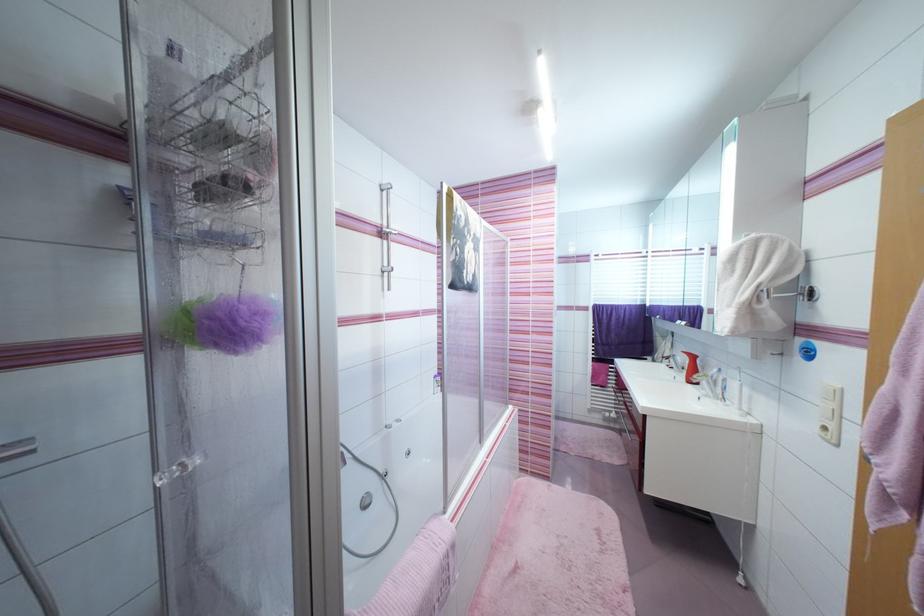
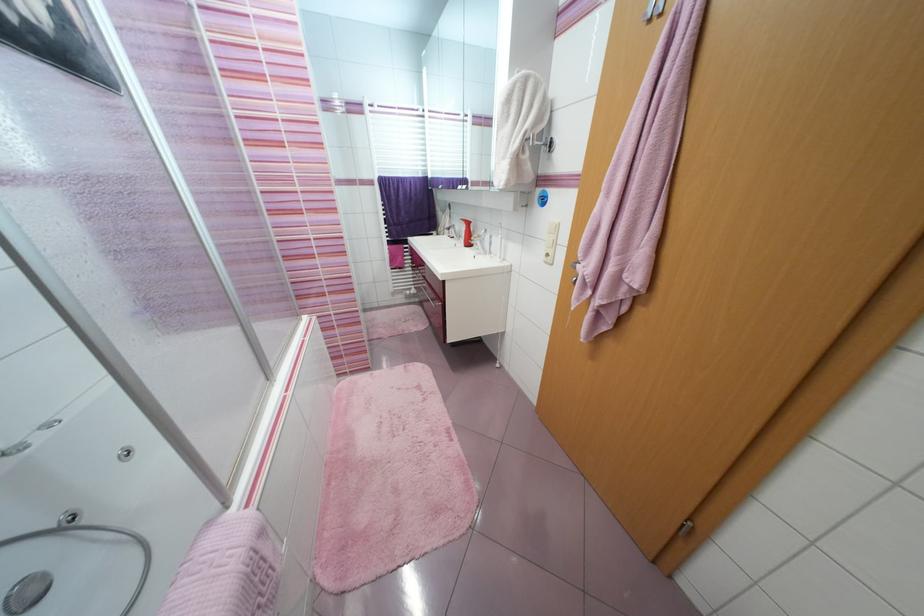
Locate, in the second image, the point that corresponds to point (647, 413) in the first image.

(445, 281)